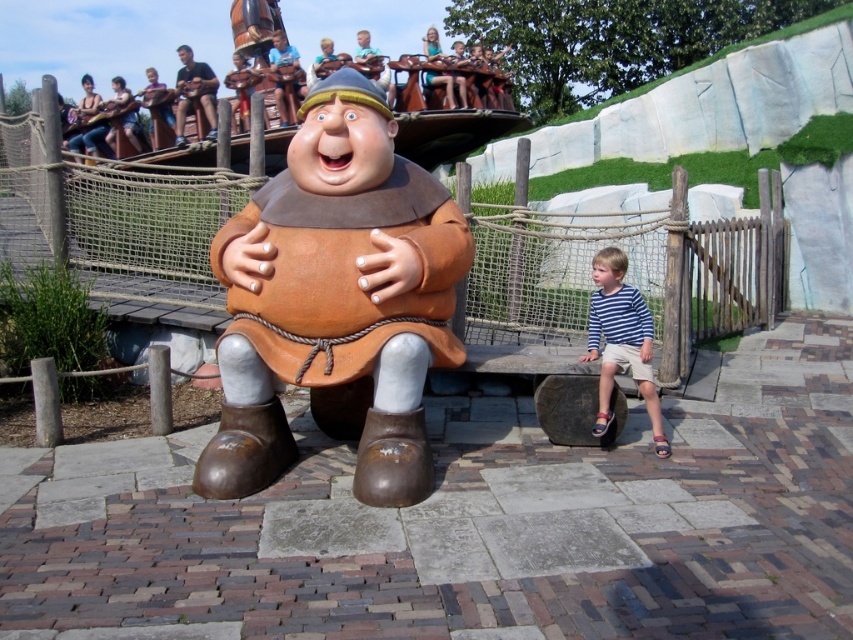
Question: Which of the following is the closest to the observer?

Choices:
 (A) blue striped shirt at lower right
 (B) brown matte statue at center
 (C) dark blue t-shirt at upper left

Answer: (B)

Question: Estimate the real-world distances between objects in this image. Which object is closer to the blue striped shirt at lower right?

Choices:
 (A) dark blue t-shirt at upper left
 (B) brown matte statue at center

Answer: (B)

Question: Is blue striped shirt at lower right positioned at the back of dark blue t-shirt at upper left?

Choices:
 (A) no
 (B) yes

Answer: (A)

Question: Is brown matte statue at center to the left of dark blue t-shirt at upper left from the viewer's perspective?

Choices:
 (A) yes
 (B) no

Answer: (B)

Question: Is brown matte statue at center bigger than blue striped shirt at lower right?

Choices:
 (A) yes
 (B) no

Answer: (A)

Question: Which object is farther from the camera taking this photo?

Choices:
 (A) dark blue t-shirt at upper left
 (B) brown matte statue at center
 (C) blue striped shirt at lower right

Answer: (A)